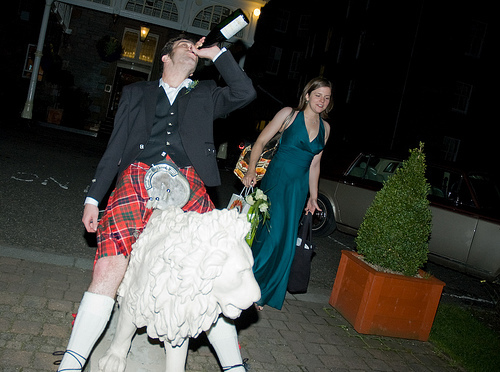
Identify the location of flower pot. (420, 303).